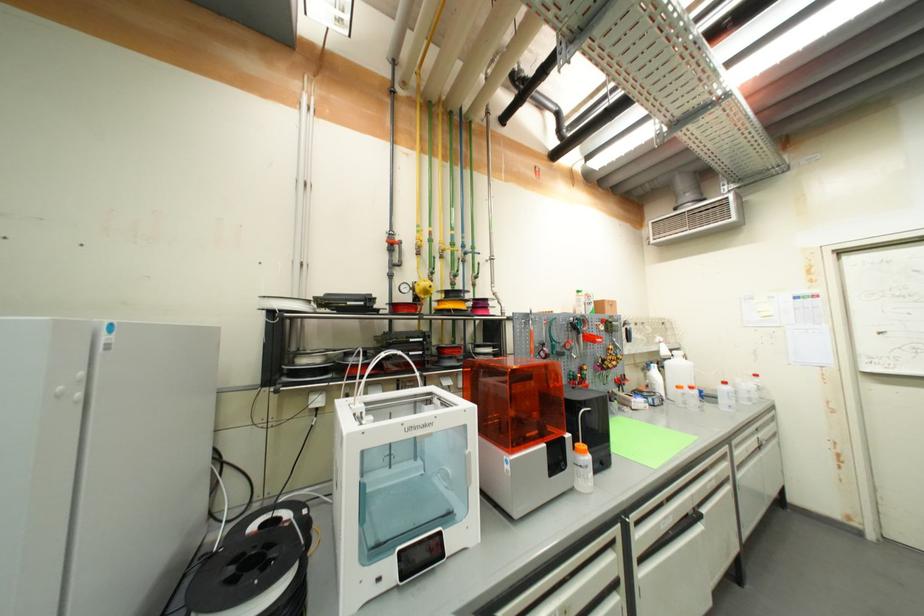
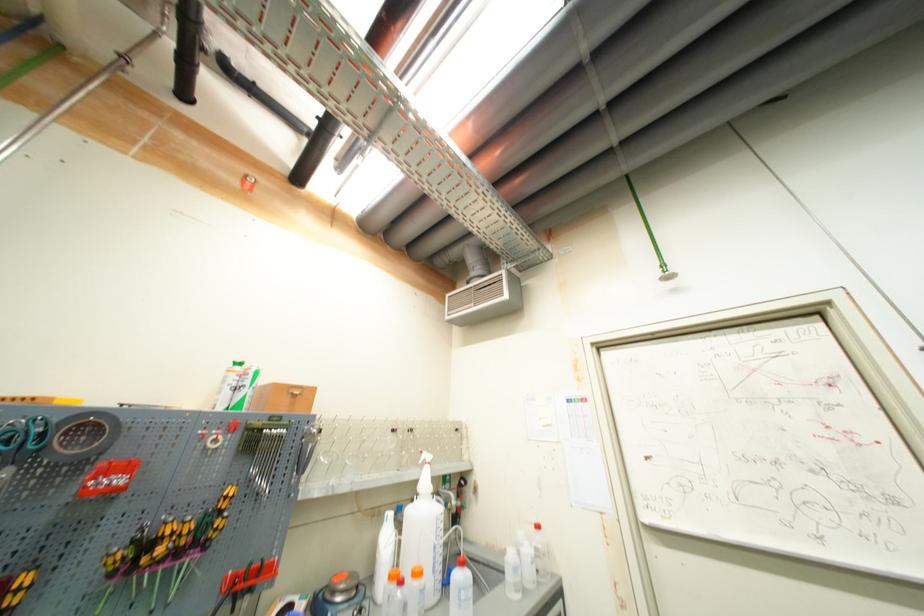
Where in the second image is the point corresponding to point 590,369 from the first image?

(30, 581)